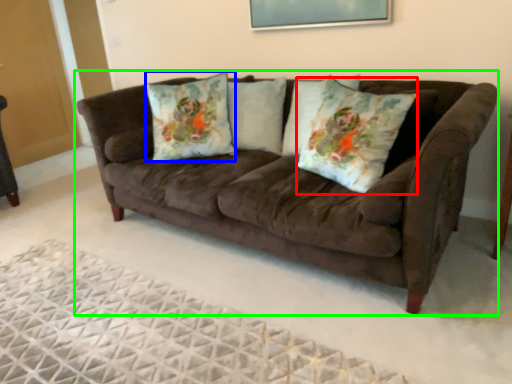
Question: Which object is the closest to the throw pillow (highlighted by a red box)? Choose among these: throw pillow (highlighted by a blue box) or studio couch (highlighted by a green box).

Choices:
 (A) throw pillow
 (B) studio couch

Answer: (B)